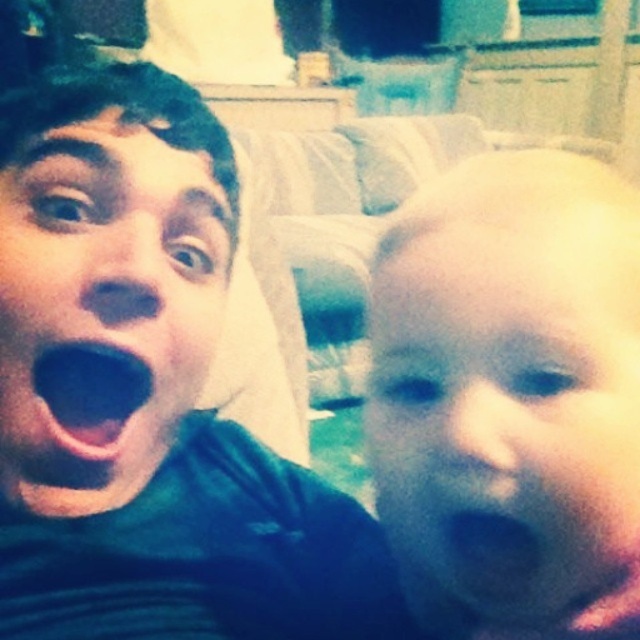
Can you confirm if smooth skin baby at right is taller than black matte mouth at left?

Indeed, smooth skin baby at right has a greater height compared to black matte mouth at left.

Does smooth skin baby at right appear under black matte mouth at left?

Yes, smooth skin baby at right is below black matte mouth at left.

Locate an element on the screen. smooth skin baby at right is located at coordinates (509, 397).

Can you confirm if smooth skin baby at right is smaller than blue matte mouth at lower right?

No.

Is point (632, 509) in front of point (477, 513)?

No, (632, 509) is behind (477, 513).

At what (x,y) coordinates should I click in order to perform the action: click on smooth skin baby at right. Please return your answer as a coordinate pair (x, y). Looking at the image, I should click on (509, 397).

Does smooth skin baby at right have a lesser width compared to green matte face at left?

No.

Does point (589, 236) lie in front of point (209, 316)?

That is True.

This screenshot has width=640, height=640. What are the coordinates of `smooth skin baby at right` in the screenshot? It's located at (509, 397).